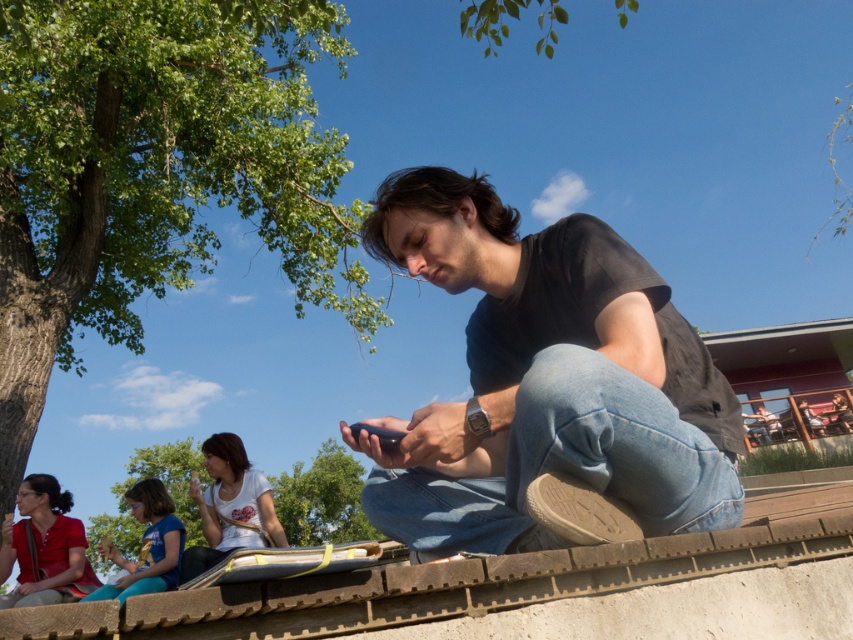
Question: In this image, where is green leafy tree at upper left located relative to white matte shirt at lower left?

Choices:
 (A) above
 (B) below

Answer: (A)

Question: Does black matte shirt at center have a smaller size compared to green leafy tree at lower left?

Choices:
 (A) yes
 (B) no

Answer: (A)

Question: Which point is closer to the camera taking this photo?

Choices:
 (A) (495, 445)
 (B) (207, 497)
 (C) (184, 512)

Answer: (A)

Question: Does matte red shirt at lower left appear over white matte shirt at lower left?

Choices:
 (A) yes
 (B) no

Answer: (B)

Question: Which point is closer to the camera?

Choices:
 (A) matte red shirt at lower left
 (B) black matte shirt at center
 (C) light brown hair at lower left

Answer: (C)

Question: Which of the following is the farthest from the observer?

Choices:
 (A) green leafy tree at upper left
 (B) black matte shirt at center

Answer: (A)